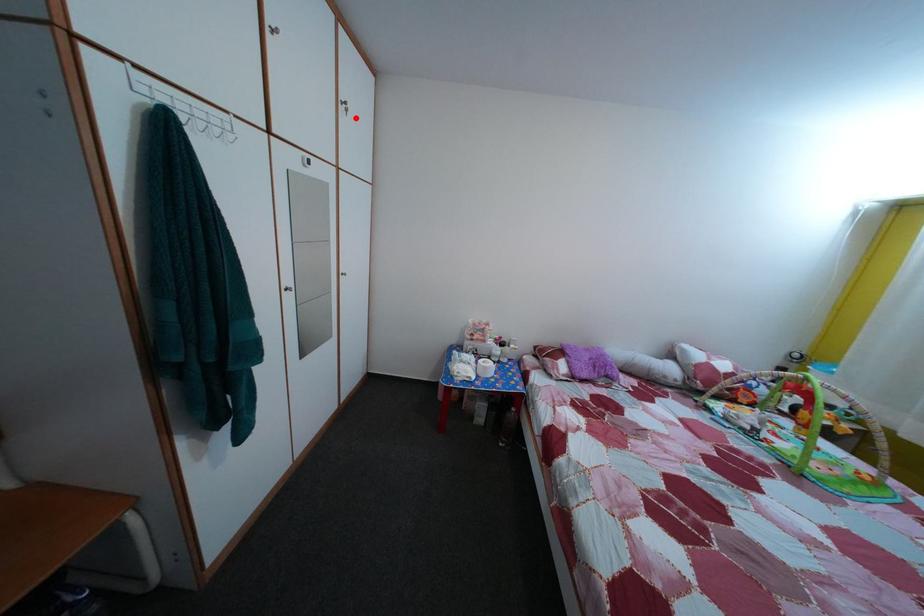
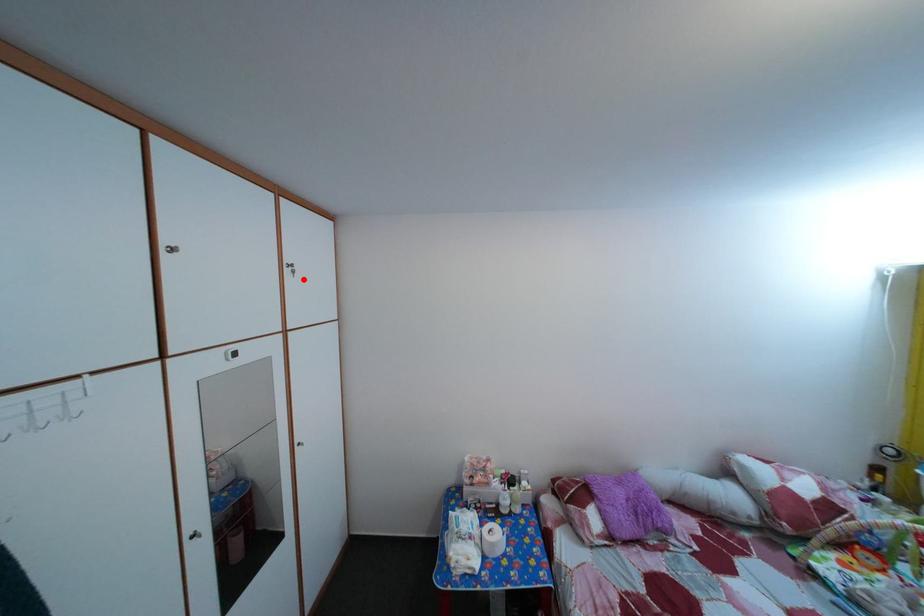
I am providing you with two images of the same scene from different viewpoints. A red point is marked on the first image and another point is marked on the second image. Is the marked point in image1 the same physical position as the marked point in image2?

Yes